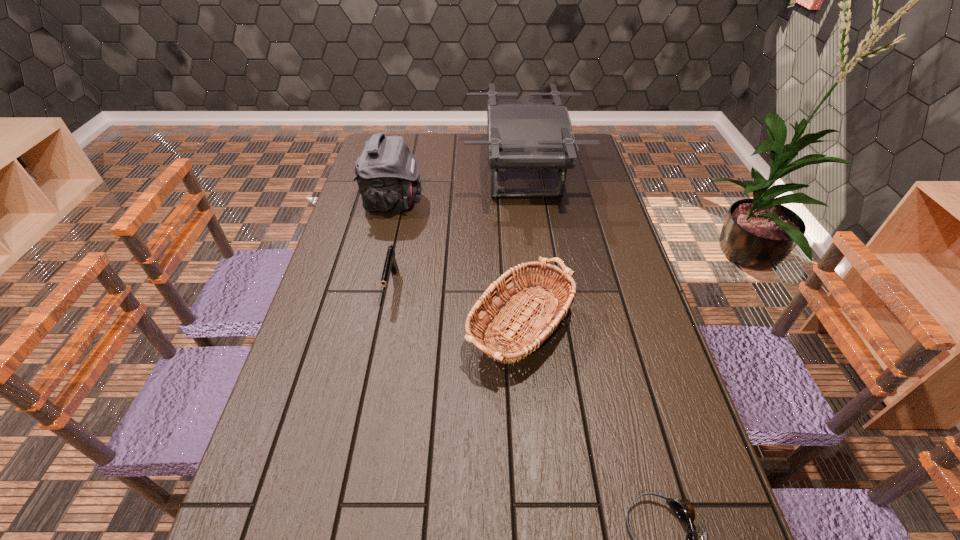
Where is `free spot between the third tallest object and the shoulder bag`? The height and width of the screenshot is (540, 960). free spot between the third tallest object and the shoulder bag is located at coordinates (463, 264).

Where is `unoccupied position between the drone and the shoulder bag`? Image resolution: width=960 pixels, height=540 pixels. unoccupied position between the drone and the shoulder bag is located at coordinates (458, 188).

You are a GUI agent. You are given a task and a screenshot of the screen. Output one action in this format:
    pyautogui.click(x=<x>, y=<y>)
    Task: Click on the empty space that is in between the shoulder bag and the pistol
    Image resolution: width=960 pixels, height=540 pixels.
    Given the screenshot: What is the action you would take?
    pyautogui.click(x=393, y=244)

Identify the location of empty location between the drone and the basket. Image resolution: width=960 pixels, height=540 pixels. (528, 250).

Find the location of a particular element. The width and height of the screenshot is (960, 540). object that stands as the closest to the drone is located at coordinates coord(387,173).

Locate which object is the third closest to the pistol. Please provide its 2D coordinates. Your answer should be formatted as a tuple, i.e. [(x, y)], where the tuple contains the x and y coordinates of a point satisfying the conditions above.

[(522, 133)]

Find the location of a particular element. The height and width of the screenshot is (540, 960). free spot that satisfies the following two spatial constraints: 1. on the open flap of the shoulder bag; 2. on the back side of the third tallest object is located at coordinates (364, 326).

Locate an element on the screen. vacant space that satisfies the following two spatial constraints: 1. with a camera mounted on the underside of the drone; 2. on the front side of the basket is located at coordinates (542, 326).

Locate an element on the screen. The width and height of the screenshot is (960, 540). free space that satisfies the following two spatial constraints: 1. with a camera mounted on the underside of the drone; 2. on the front side of the basket is located at coordinates (542, 326).

This screenshot has width=960, height=540. In order to click on vacant region that satisfies the following two spatial constraints: 1. on the open flap of the shoulder bag; 2. on the left side of the third shortest object in this screenshot , I will do [x=364, y=326].